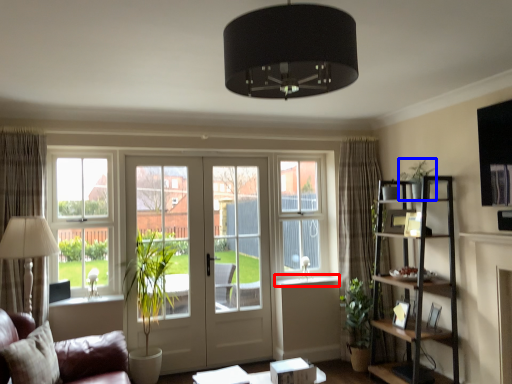
Question: Which point is closer to the camera, window sill (highlighted by a red box) or plant (highlighted by a blue box)?

Choices:
 (A) window sill
 (B) plant

Answer: (B)